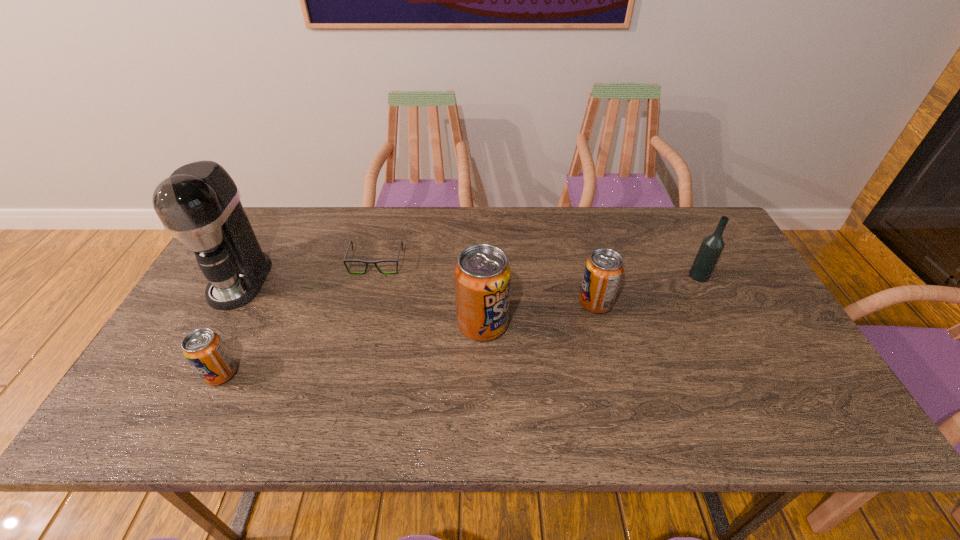
Where is `free space between the nearest soda can and the fourth object from left to right`? The image size is (960, 540). free space between the nearest soda can and the fourth object from left to right is located at coordinates (351, 349).

Where is `vacant area between the leftmost soda can and the third shortest object`? The height and width of the screenshot is (540, 960). vacant area between the leftmost soda can and the third shortest object is located at coordinates (408, 338).

Where is `unoccupied area between the fifth tallest object and the rightmost soda can`? unoccupied area between the fifth tallest object and the rightmost soda can is located at coordinates (408, 338).

Image resolution: width=960 pixels, height=540 pixels. Identify the location of vacant space in between the coffee maker and the shortest object. (308, 272).

Locate an element on the screen. The image size is (960, 540). vacant region between the tallest soda can and the spectacles is located at coordinates (429, 293).

Identify the location of object that stands as the third closest to the rightmost object. (349, 260).

Select which object appears as the closest to the leftmost soda can. Please provide its 2D coordinates. Your answer should be formatted as a tuple, i.e. [(x, y)], where the tuple contains the x and y coordinates of a point satisfying the conditions above.

[(199, 204)]

Where is `soda can identified as the closest to the rightmost object`? The height and width of the screenshot is (540, 960). soda can identified as the closest to the rightmost object is located at coordinates (603, 271).

Locate an element on the screen. This screenshot has height=540, width=960. soda can object that ranks as the closest to the shortest soda can is located at coordinates (482, 276).

Find the location of a particular element. The width and height of the screenshot is (960, 540). free space that satisfies the following two spatial constraints: 1. place cup under the spout of the second tallest soda can; 2. on the right side of the tallest object is located at coordinates (228, 302).